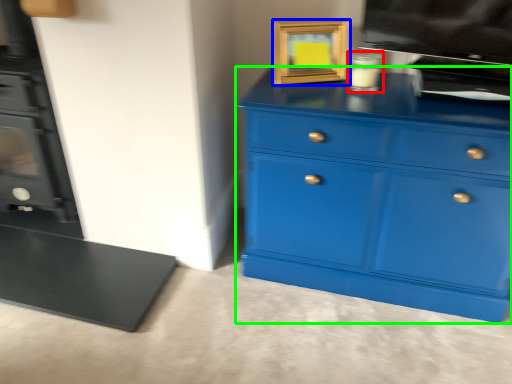
Question: Which object is positioned farthest from appliance (highlighted by a red box)? Select from picture frame (highlighted by a blue box) and chest of drawers (highlighted by a green box).

Choices:
 (A) picture frame
 (B) chest of drawers

Answer: (B)